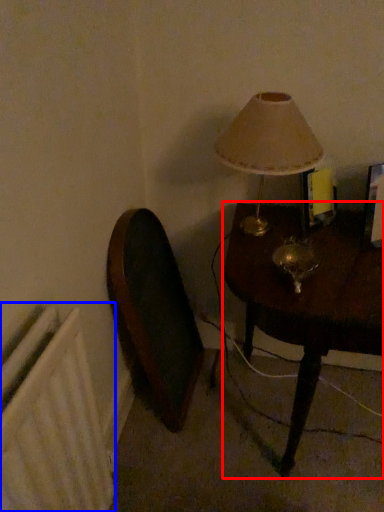
Question: Which object appears closest to the camera in this image, table (highlighted by a red box) or radiator (highlighted by a blue box)?

Choices:
 (A) table
 (B) radiator

Answer: (B)